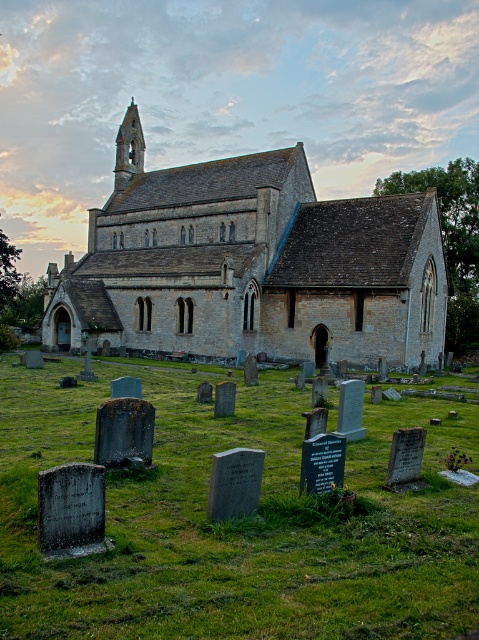
Does stone church at center appear under smooth stone spire at upper left?

Indeed, stone church at center is positioned under smooth stone spire at upper left.

Does point (283, 211) come in front of point (124, 140)?

Yes, point (283, 211) is closer to viewer.

Identify the location of stone church at center. (253, 268).

Locate an element on the screen. green mossy grass at lower center is located at coordinates (234, 522).

Where is `green mossy grass at lower center`? green mossy grass at lower center is located at coordinates (234, 522).

Which is more to the left, green mossy grass at lower center or stone church at center?

Positioned to the left is stone church at center.

Can you confirm if green mossy grass at lower center is positioned to the right of stone church at center?

Indeed, green mossy grass at lower center is positioned on the right side of stone church at center.

Who is more forward, (286, 486) or (65, 268)?

Point (286, 486)

Where is `green mossy grass at lower center`? This screenshot has width=479, height=640. green mossy grass at lower center is located at coordinates (234, 522).